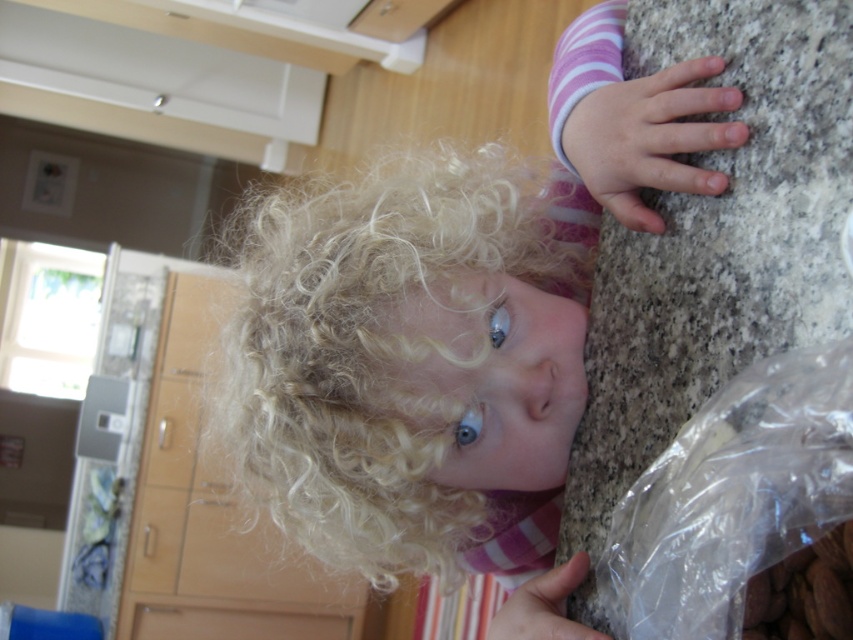
Does blonde curly hair at upper center appear under transparent plastic bag at right?

No, blonde curly hair at upper center is not below transparent plastic bag at right.

Is point (480, 209) positioned behind point (653, 600)?

Yes, point (480, 209) is behind point (653, 600).

Identify the location of blonde curly hair at upper center. The image size is (853, 640). (450, 326).